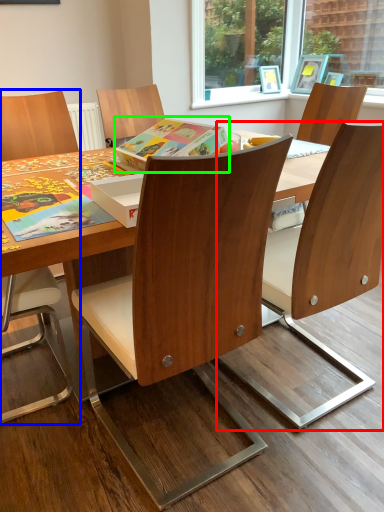
Question: Considering the real-world distances, which object is farthest from chair (highlighted by a red box)? chair (highlighted by a blue box) or book (highlighted by a green box)?

Choices:
 (A) chair
 (B) book

Answer: (A)